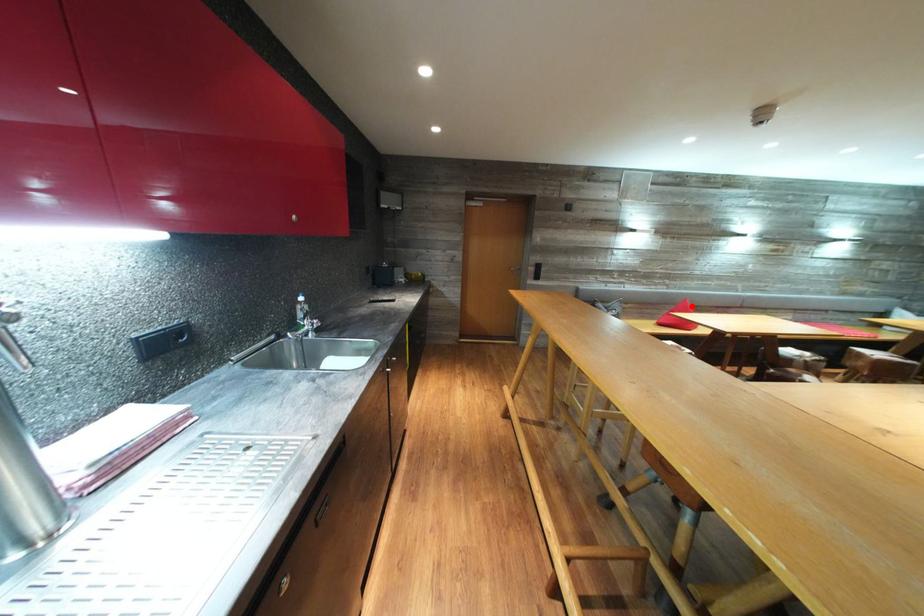
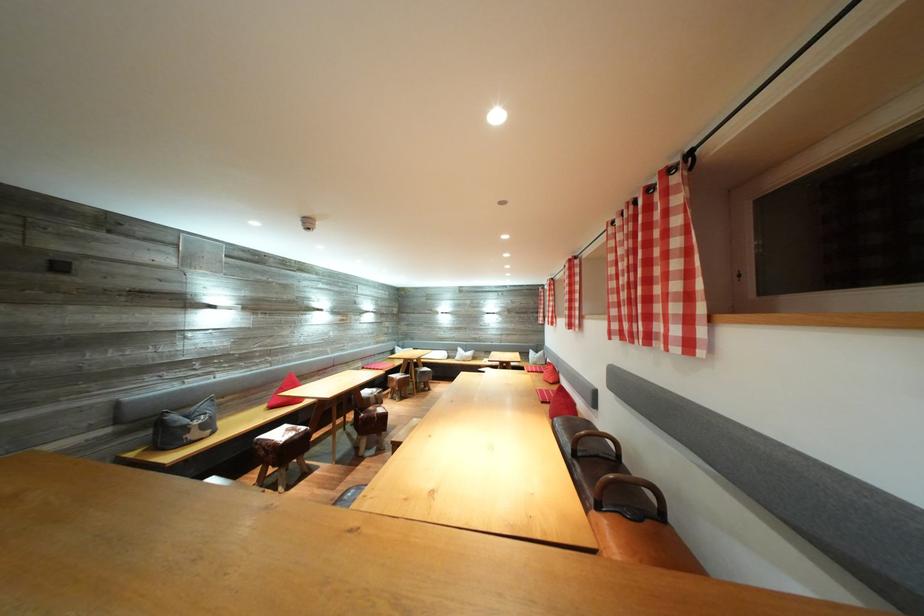
Locate, in the second image, the point that corresponds to the highlighted location in the first image.

(298, 379)